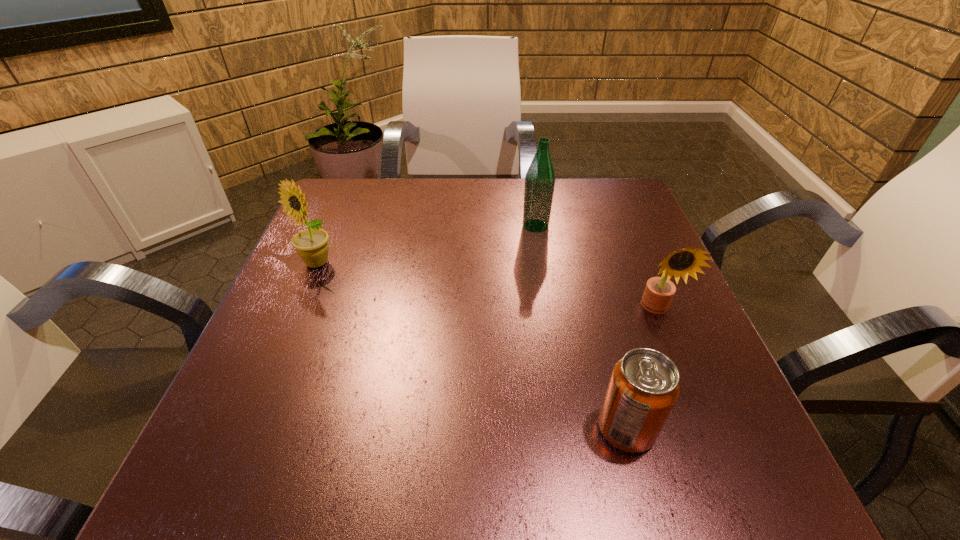
Image resolution: width=960 pixels, height=540 pixels. Find the location of `vacant region located 0.220m on the face of the right sunflower`. vacant region located 0.220m on the face of the right sunflower is located at coordinates (707, 431).

The height and width of the screenshot is (540, 960). What are the coordinates of `free point located 0.200m on the back of the nearest object` in the screenshot? It's located at (595, 313).

Locate an element on the screen. The image size is (960, 540). object located at the far edge is located at coordinates (540, 177).

The width and height of the screenshot is (960, 540). In order to click on object that is positioned at the near edge in this screenshot , I will do `click(644, 386)`.

You are a GUI agent. You are given a task and a screenshot of the screen. Output one action in this format:
    pyautogui.click(x=<x>, y=<y>)
    Task: Click on the object that is at the left edge
    
    Given the screenshot: What is the action you would take?
    pyautogui.click(x=312, y=246)

Where is `sunflower present at the right edge`? The width and height of the screenshot is (960, 540). sunflower present at the right edge is located at coordinates (659, 291).

Image resolution: width=960 pixels, height=540 pixels. I want to click on soda can present at the right edge, so click(x=644, y=386).

Identify the location of object that is at the near right corner. (644, 386).

Image resolution: width=960 pixels, height=540 pixels. I want to click on vacant region at the far edge of the desktop, so click(431, 226).

Locate an element on the screen. The height and width of the screenshot is (540, 960). blank area at the near edge is located at coordinates (438, 473).